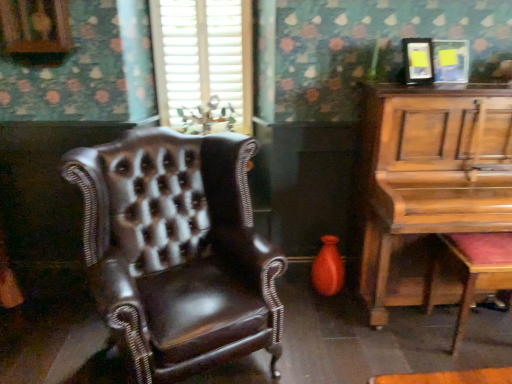
I want to click on vacant point to the right of shiny brown leather chair at left, so click(x=325, y=339).